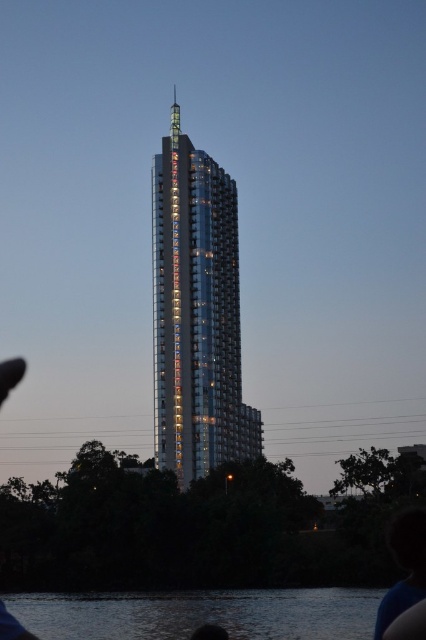
The image size is (426, 640). What do you see at coordinates (196, 314) in the screenshot? I see `shiny metallic building at center` at bounding box center [196, 314].

Who is more forward, (166,211) or (146,637)?

Positioned in front is point (146,637).

Between point (235, 196) and point (278, 618), which one is positioned behind?

The point (235, 196) is behind.

At what (x,y) coordinates should I click in order to perform the action: click on shiny metallic building at center. Please return your answer as a coordinate pair (x, y). Image resolution: width=426 pixels, height=640 pixels. Looking at the image, I should click on (196, 314).